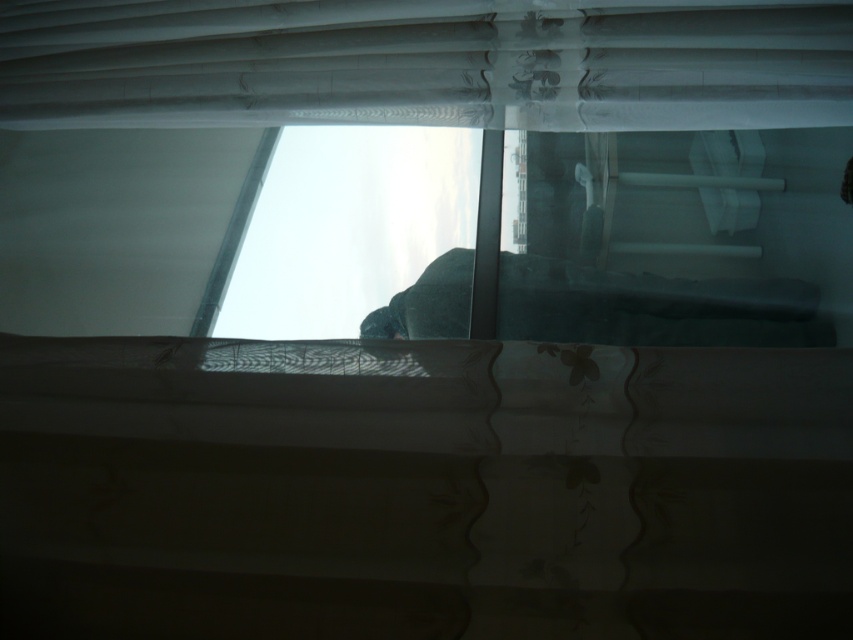
Question: Is transparent glass window at center to the left of sheer white curtain at upper center from the viewer's perspective?

Choices:
 (A) yes
 (B) no

Answer: (B)

Question: Can you confirm if transparent glass window at center is positioned above sheer white curtain at upper center?

Choices:
 (A) no
 (B) yes

Answer: (A)

Question: Which point appears closest to the camera in this image?

Choices:
 (A) (47, 42)
 (B) (401, 128)

Answer: (A)

Question: Which of the following is the farthest from the observer?

Choices:
 (A) sheer white curtain at upper center
 (B) transparent glass window at center

Answer: (B)

Question: Is the position of transparent glass window at center less distant than that of sheer white curtain at upper center?

Choices:
 (A) yes
 (B) no

Answer: (B)